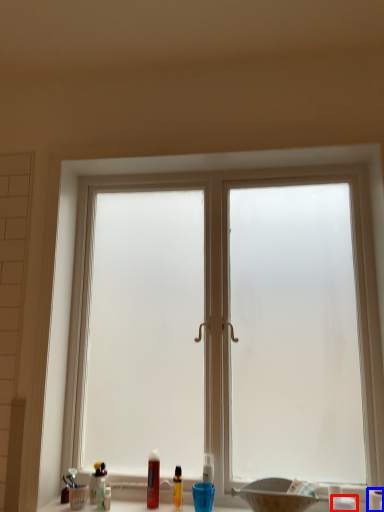
Question: Among these objects, which one is nearest to the camera, toiletry (highlighted by a red box) or toilet paper (highlighted by a blue box)?

Choices:
 (A) toiletry
 (B) toilet paper

Answer: (A)